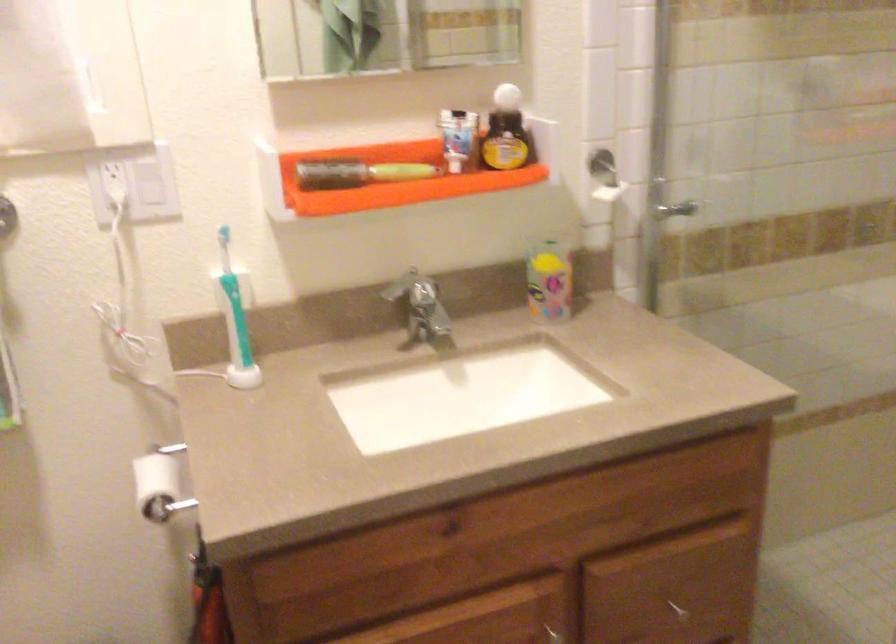
This screenshot has width=896, height=644. In order to click on silver faucet handle in this screenshot , I will do `click(419, 306)`.